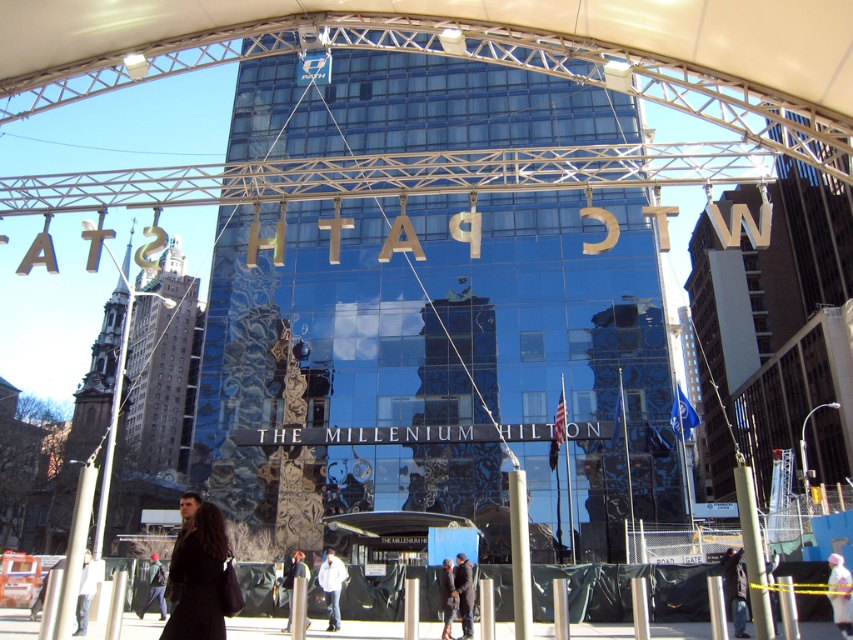
Question: Does white fabric at lower right appear over white matte jacket at center?

Choices:
 (A) yes
 (B) no

Answer: (A)

Question: Is dark brown leather coat at lower center to the right of dark gray coat at lower right from the viewer's perspective?

Choices:
 (A) yes
 (B) no

Answer: (B)

Question: Which point appears farthest from the camera in this image?

Choices:
 (A) (337, 630)
 (B) (79, 625)

Answer: (A)

Question: Which object is positioned closest to the dark brown leather coat at lower center?

Choices:
 (A) white matte jacket at center
 (B) dark gray coat at lower right
 (C) dark gray jacket at center
 (D) light brown leather jacket at lower left

Answer: (D)

Question: Which point is farther from the camera taking this photo?

Choices:
 (A) (740, 556)
 (B) (161, 596)

Answer: (B)

Question: Is dark brown leather jacket at lower center bigger than dark gray jacket at lower left?

Choices:
 (A) yes
 (B) no

Answer: (B)